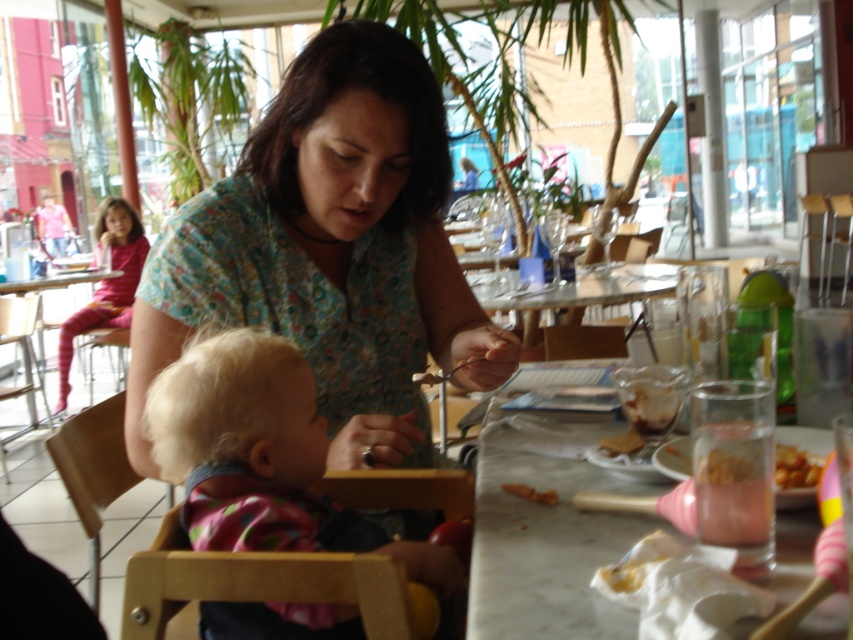
What do you see at coordinates (548, 528) in the screenshot?
I see `marble table at lower right` at bounding box center [548, 528].

Can you confirm if marble table at lower right is shorter than orange matte carrot at center?

No.

Which is in front, point (502, 608) or point (552, 497)?

Point (502, 608)

Locate an element on the screen. This screenshot has height=640, width=853. marble table at lower right is located at coordinates (548, 528).

Which is above, marble table at lower right or wooden high chair at lower left?

wooden high chair at lower left is above.

Who is more forward, (786, 532) or (91, 280)?

Positioned in front is point (786, 532).

Find the location of `marble table at lower right`. marble table at lower right is located at coordinates pyautogui.click(x=548, y=528).

Who is more distant from viewer, (364,547) or (76,330)?

Positioned behind is point (76,330).

Which is more to the left, blonde hair at center or pink striped pants at upper left?

Positioned to the left is pink striped pants at upper left.

Locate an element on the screen. The image size is (853, 640). blonde hair at center is located at coordinates (262, 458).

I want to click on blonde hair at center, so click(262, 458).